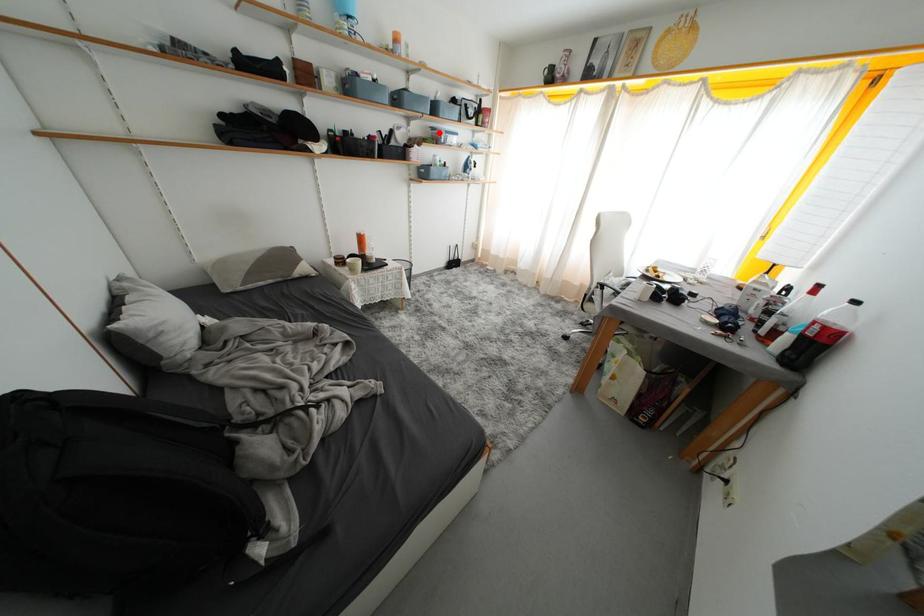
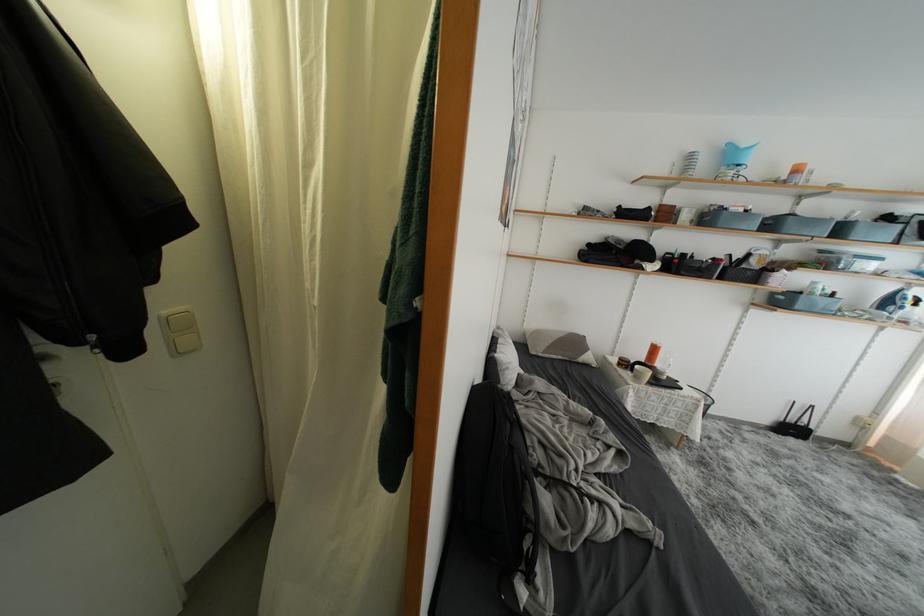
In the second image, find the point that corresponds to the highlighted location in the first image.

(829, 256)